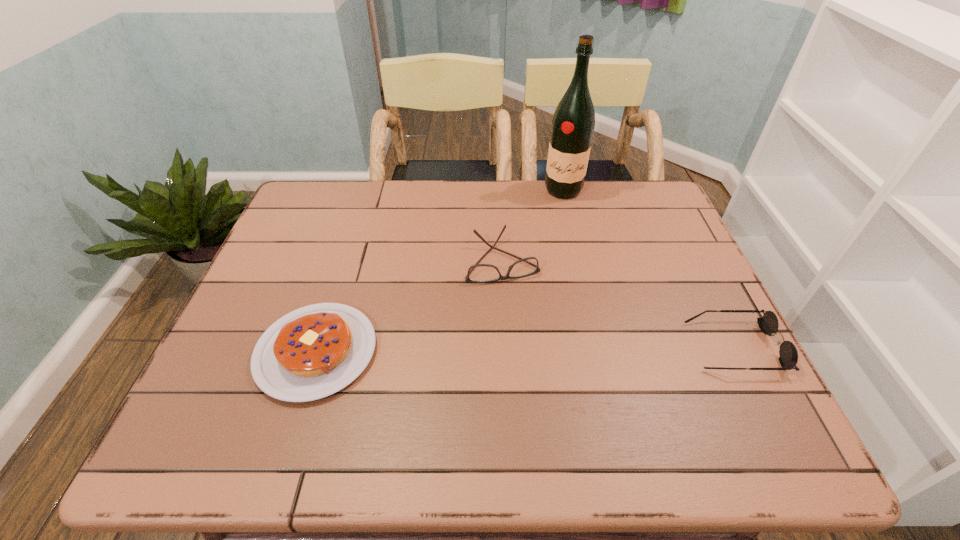
At what (x,y) coordinates should I click in order to perform the action: click on free space that is in between the third object from right to left and the second object from right to left. Please return your answer as a coordinate pair (x, y). The image size is (960, 540). Looking at the image, I should click on (533, 225).

This screenshot has width=960, height=540. Find the location of `vacant space that is in between the liquor and the pancake`. vacant space that is in between the liquor and the pancake is located at coordinates (440, 271).

The image size is (960, 540). Identify the location of vacant point located between the second object from left to right and the leftmost object. (409, 306).

Find the location of a particular element. Image resolution: width=960 pixels, height=540 pixels. vacant space that's between the pancake and the liquor is located at coordinates coord(440,271).

You are a GUI agent. You are given a task and a screenshot of the screen. Output one action in this format:
    pyautogui.click(x=<x>, y=<y>)
    Task: Click on the free point between the rightmost object and the farthest object
    This screenshot has height=540, width=960.
    Given the screenshot: What is the action you would take?
    pos(648,268)

At what (x,y) coordinates should I click in order to perform the action: click on vacant space that is in between the third object from left to right and the third nearest object. Please return your answer as a coordinate pair (x, y). Looking at the image, I should click on (533, 225).

Choose which object is the nearest neighbor to the tallest object. Please provide its 2D coordinates. Your answer should be formatted as a tuple, i.e. [(x, y)], where the tuple contains the x and y coordinates of a point satisfying the conditions above.

[(479, 273)]

Where is `object that is the third closest one to the second object from left to right`? The image size is (960, 540). object that is the third closest one to the second object from left to right is located at coordinates (768, 324).

Locate an element on the screen. The height and width of the screenshot is (540, 960). vacant space that satisfies the following two spatial constraints: 1. on the front side of the farthest object; 2. on the front-facing side of the rightmost object is located at coordinates (600, 347).

In order to click on free space that satisfies the following two spatial constraints: 1. on the front side of the liquor; 2. on the front-facing side of the sunglasses in this screenshot , I will do `click(600, 347)`.